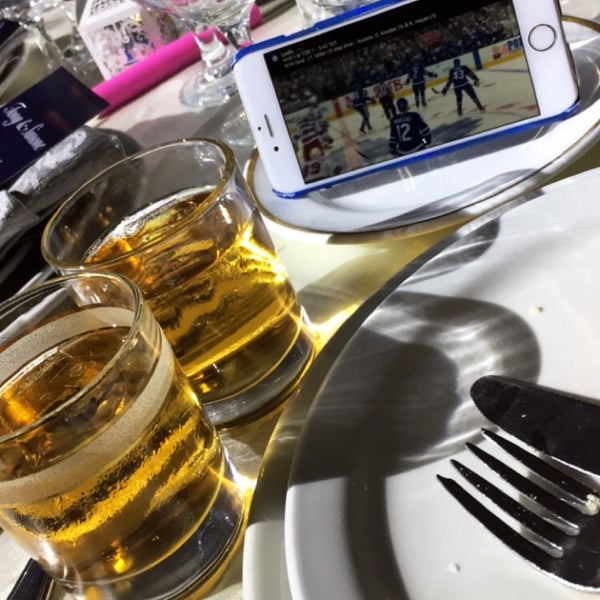
Where is `purple candle`? This screenshot has width=600, height=600. purple candle is located at coordinates (132, 76).